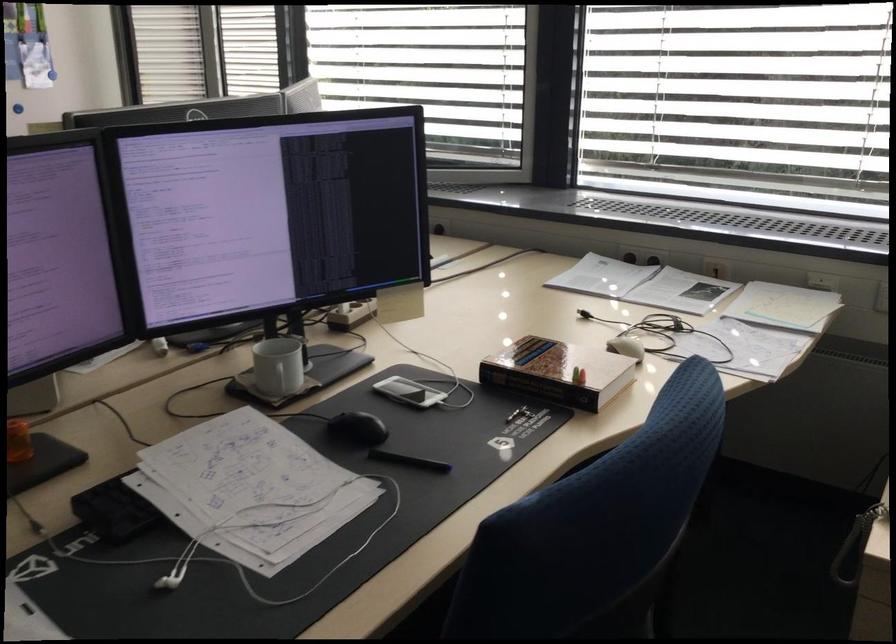
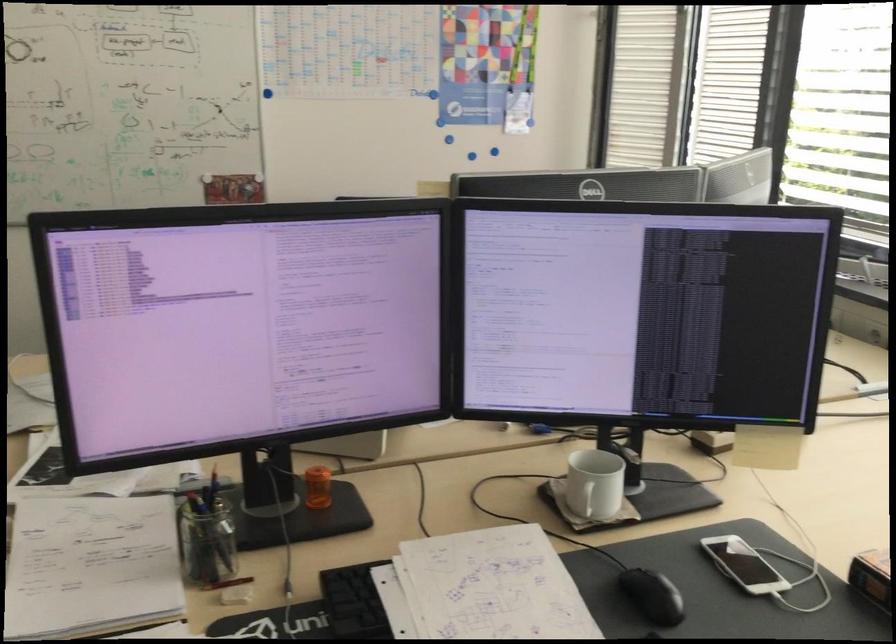
Where in the second image is the point corresponding to [364,426] from the first image?

(652, 596)